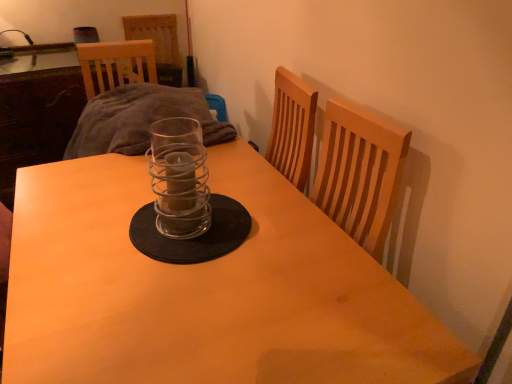
Find the location of `free space above wooden table at center (from a real-world perspective)`. free space above wooden table at center (from a real-world perspective) is located at coordinates (185, 266).